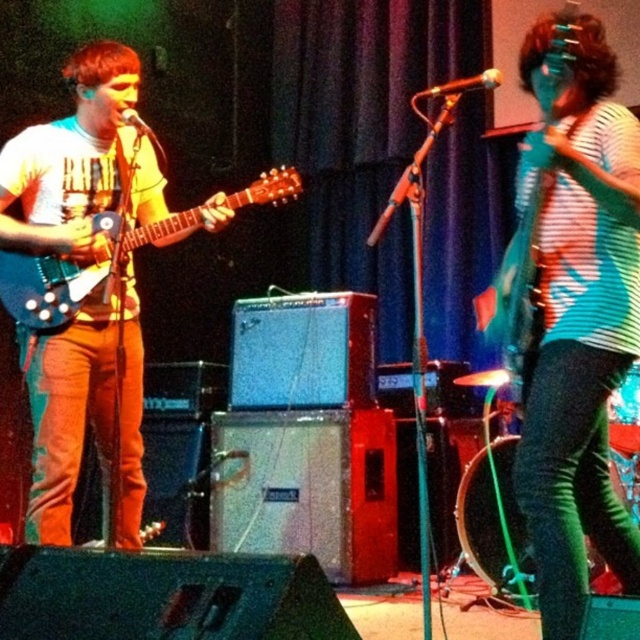
Can you confirm if matte black guitar at left is positioned to the left of metallic silver microphone at center?

Correct, you'll find matte black guitar at left to the left of metallic silver microphone at center.

Is matte black guitar at left thinner than metallic silver microphone at center?

In fact, matte black guitar at left might be wider than metallic silver microphone at center.

What do you see at coordinates (88, 412) in the screenshot?
I see `matte black guitar at left` at bounding box center [88, 412].

This screenshot has height=640, width=640. Find the location of `matte black guitar at left`. matte black guitar at left is located at coordinates (88, 412).

Is striped fabric shirt at center to the right of metallic silver microphone at center from the viewer's perspective?

Incorrect, striped fabric shirt at center is not on the right side of metallic silver microphone at center.

Does point (560, 173) come closer to viewer compared to point (429, 92)?

Yes, point (560, 173) is closer to viewer.

The image size is (640, 640). I want to click on striped fabric shirt at center, so click(x=570, y=310).

Locate an element on the screen. striped fabric shirt at center is located at coordinates (570, 310).

Does metallic silver microphone at center appear on the right side of metallic silver microphone at upper center?

Yes, metallic silver microphone at center is to the right of metallic silver microphone at upper center.

Consider the image. Can you confirm if metallic silver microphone at center is positioned above metallic silver microphone at upper center?

Correct, metallic silver microphone at center is located above metallic silver microphone at upper center.

Find the location of a particular element. This screenshot has height=640, width=640. metallic silver microphone at center is located at coordinates (461, 84).